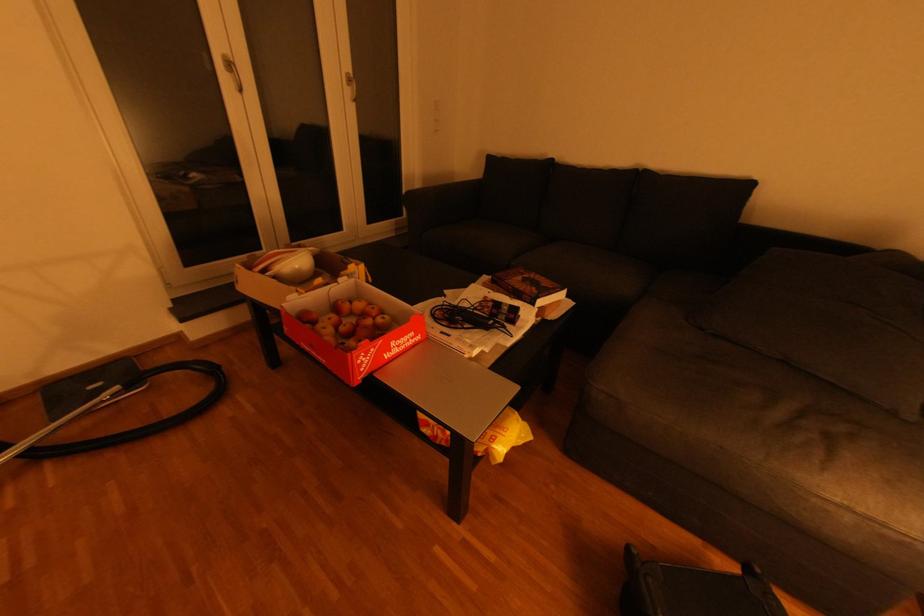
Where would you grasp the vacuum cleaner wand? Please return your answer as a coordinate pair (x, y).

(120, 415)